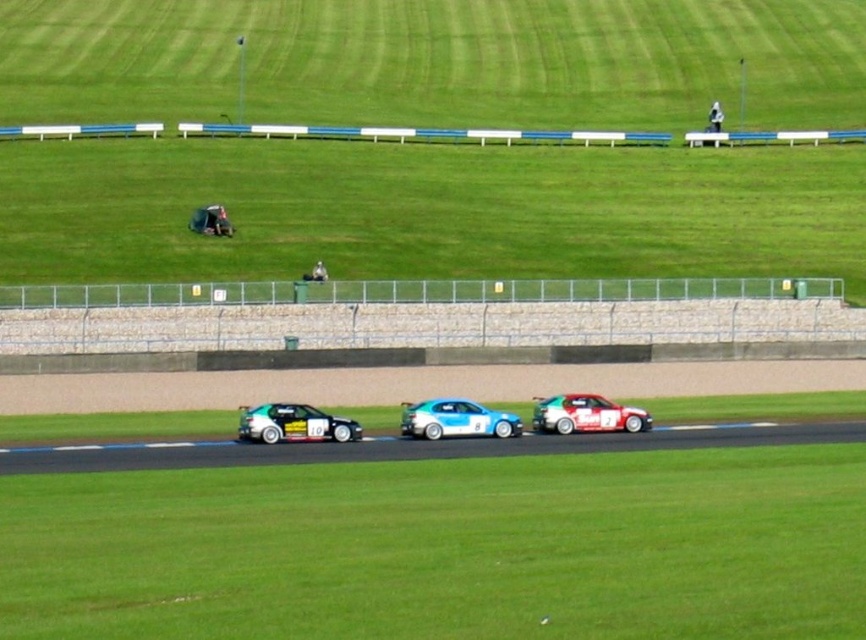
Question: Which point is closer to the camera?

Choices:
 (A) green matte race car at center
 (B) matte black race car at lower left
 (C) shiny white sports car at center

Answer: (B)

Question: Is matte black race car at lower left below shiny white sports car at center?

Choices:
 (A) yes
 (B) no

Answer: (B)

Question: Which of these objects is positioned farthest from the shiny white sports car at center?

Choices:
 (A) brown asphalt track at center
 (B) smooth asphalt race track at center
 (C) blue glossy hatchback at center
 (D) green matte race car at center

Answer: (A)

Question: Which point is farther to the camera?

Choices:
 (A) pyautogui.click(x=227, y=230)
 (B) pyautogui.click(x=406, y=429)

Answer: (A)

Question: Does smooth asphalt race track at center appear on the left side of shiny white sports car at center?

Choices:
 (A) no
 (B) yes

Answer: (B)

Question: Does brown asphalt track at center appear under green matte race car at center?

Choices:
 (A) no
 (B) yes

Answer: (A)